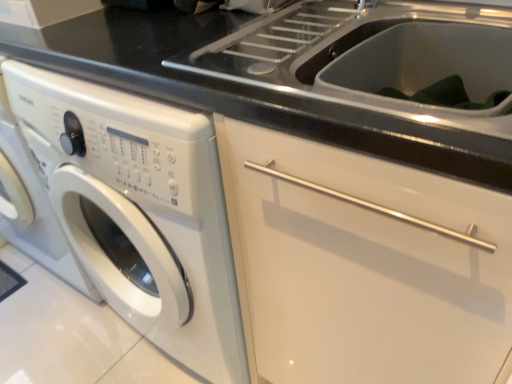
Describe the element at coordinates (138, 212) in the screenshot. I see `white glossy washing machine at left` at that location.

This screenshot has width=512, height=384. Identify the location of white glossy washing machine at left. (138, 212).

Find the location of `white glossy washing machine at left`. white glossy washing machine at left is located at coordinates (138, 212).